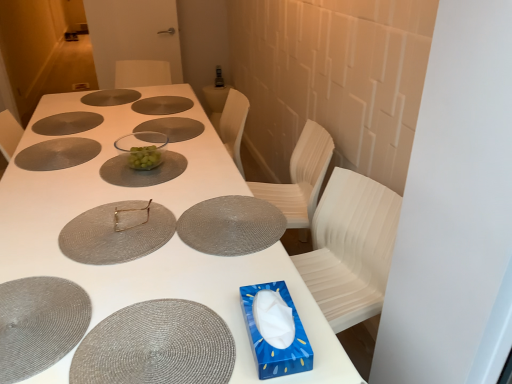
Where is `vacant space in between matte gray glass plate at upper left, the third glass plate in the back-to-front sequence, and blue paper tissue box at lower right`? Image resolution: width=512 pixels, height=384 pixels. vacant space in between matte gray glass plate at upper left, the third glass plate in the back-to-front sequence, and blue paper tissue box at lower right is located at coordinates (120, 175).